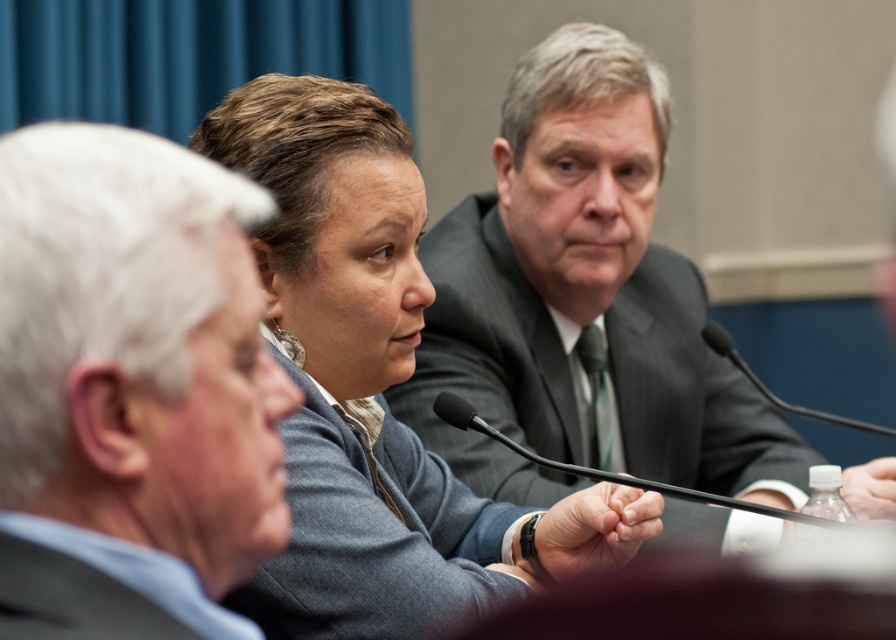
Question: Among these points, which one is farthest from the camera?

Choices:
 (A) (4, 572)
 (B) (368, 493)

Answer: (B)

Question: Among these points, which one is nearest to the camera?

Choices:
 (A) (109, 618)
 (B) (423, 600)
 (C) (582, 324)
 (D) (20, 177)

Answer: (A)

Question: Can you confirm if dark gray suit at center is positioned to the right of white cotton shirt at lower left?

Choices:
 (A) yes
 (B) no

Answer: (A)

Question: Can you confirm if gray suit at center is positioned below white cotton shirt at lower left?

Choices:
 (A) yes
 (B) no

Answer: (B)

Question: Considering the relative positions of dark gray suit at center and dark gray textured suit at center in the image provided, where is dark gray suit at center located with respect to dark gray textured suit at center?

Choices:
 (A) right
 (B) left

Answer: (A)

Question: Considering the real-world distances, which object is closest to the white cotton shirt at lower left?

Choices:
 (A) matte gray sweater at center
 (B) gray suit at center
 (C) dark gray suit at center

Answer: (B)